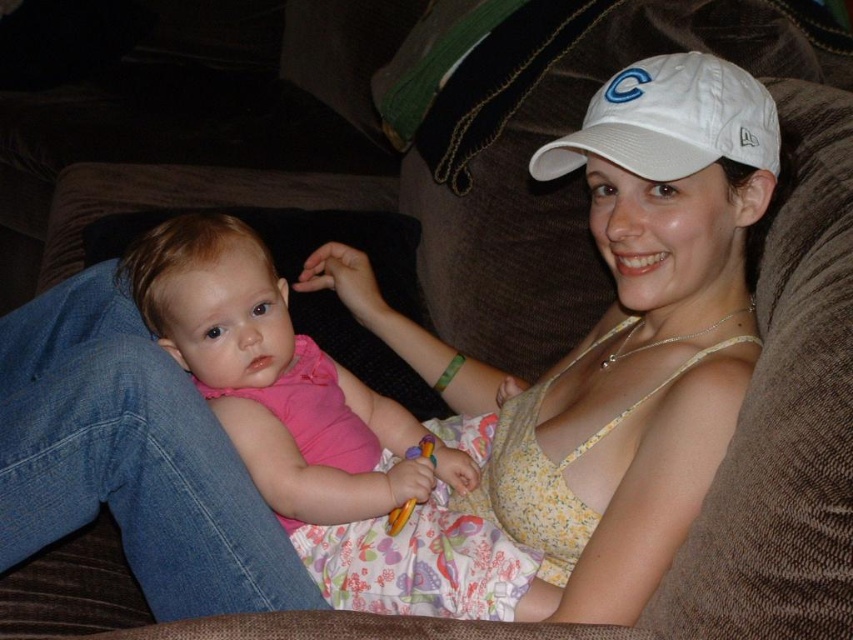
You are a photographer setting up for a family photo. You notice the pink fabric baby at center and the white fabric cap at upper center in the scene. Which object should you adjust to ensure both are visible in the frame?

The white fabric cap at upper center is positioned above the pink fabric baby at center. To ensure both are visible, you should adjust the white fabric cap at upper center to move it slightly downward or the pink fabric baby at center upward so they don not overlap in the frame.

Please describe the location of the point at coordinates (270, 372) in the image.

Result: The point at coordinates (270, 372) corresponds to the pink fabric baby at center.